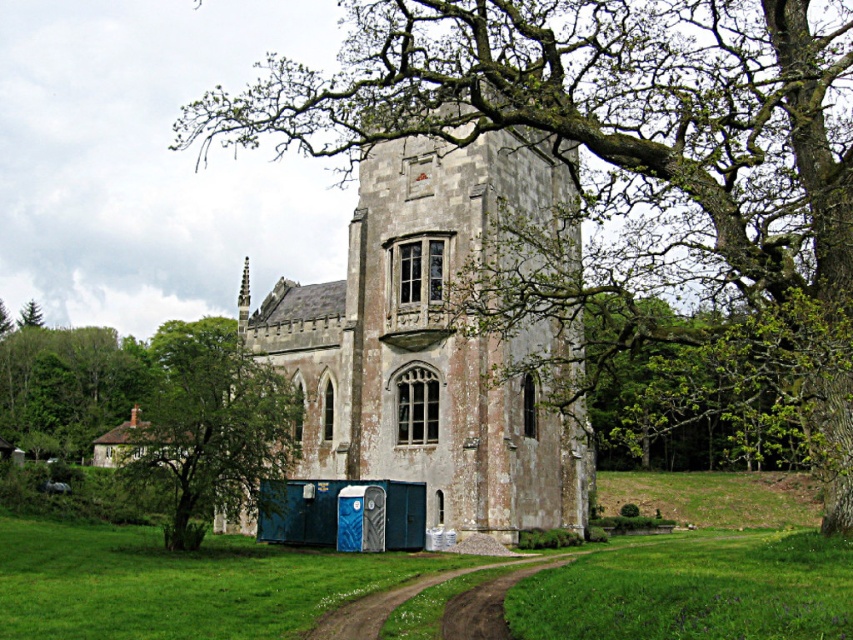
Does smooth bark tree at center have a larger size compared to stone church at center?

Yes.

Image resolution: width=853 pixels, height=640 pixels. I want to click on smooth bark tree at center, so click(x=608, y=124).

The width and height of the screenshot is (853, 640). What do you see at coordinates (178, 582) in the screenshot?
I see `green grassy at lower left` at bounding box center [178, 582].

Does green grassy at lower left have a lesser height compared to green grassy field at lower right?

Yes.

Who is more forward, (x=9, y=518) or (x=846, y=618)?

Point (x=846, y=618) is more forward.

At what (x,y) coordinates should I click in order to perform the action: click on green grassy at lower left. Please return your answer as a coordinate pair (x, y). Looking at the image, I should click on (178, 582).

Between smooth bark tree at center and green leafy tree at center, which one has less height?

green leafy tree at center

Between point (575, 128) and point (189, 486), which one is positioned behind?

The point (189, 486) is behind.

I want to click on smooth bark tree at center, so click(608, 124).